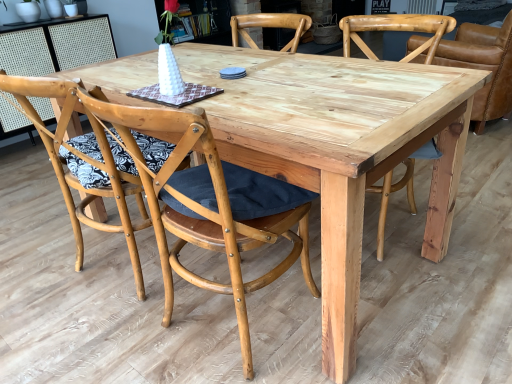
Question: Should I look upward or downward to see natural wood chair at center, which ranks as the first chair in left-to-right order?

Choices:
 (A) up
 (B) down

Answer: (A)

Question: Does natural wood chair at center, which ranks as the second chair in right-to-left order, have a lesser height compared to natural wood chair at right, which is counted as the fourth chair, starting from the left?

Choices:
 (A) yes
 (B) no

Answer: (B)

Question: Does natural wood chair at center, marked as the third chair in a left-to-right arrangement, have a greater width compared to natural wood chair at right, which is counted as the fourth chair, starting from the left?

Choices:
 (A) yes
 (B) no

Answer: (B)

Question: Is natural wood chair at center, which ranks as the second chair in right-to-left order, thinner than natural wood chair at right, the first chair viewed from the right?

Choices:
 (A) yes
 (B) no

Answer: (A)

Question: Is natural wood chair at center, which ranks as the second chair in right-to-left order, positioned beyond the bounds of natural wood chair at right, the first chair viewed from the right?

Choices:
 (A) yes
 (B) no

Answer: (A)

Question: From the image's perspective, is natural wood chair at center, marked as the third chair in a left-to-right arrangement, on natural wood chair at right, which is counted as the fourth chair, starting from the left?

Choices:
 (A) no
 (B) yes

Answer: (A)

Question: Does natural wood chair at center, which ranks as the second chair in right-to-left order, touch natural wood chair at right, the first chair viewed from the right?

Choices:
 (A) yes
 (B) no

Answer: (B)

Question: From the image's perspective, is natural wood chair at right, which is counted as the fourth chair, starting from the left, beneath natural wood chair at center, which ranks as the second chair in right-to-left order?

Choices:
 (A) no
 (B) yes

Answer: (A)

Question: Could you tell me if natural wood chair at right, which is counted as the fourth chair, starting from the left, is turned towards natural wood chair at center, which ranks as the second chair in right-to-left order?

Choices:
 (A) yes
 (B) no

Answer: (B)

Question: Is natural wood chair at right, which is counted as the fourth chair, starting from the left, oriented away from natural wood chair at center, which ranks as the second chair in right-to-left order?

Choices:
 (A) no
 (B) yes

Answer: (A)

Question: Are natural wood chair at right, the first chair viewed from the right, and natural wood chair at center, which ranks as the second chair in right-to-left order, far apart?

Choices:
 (A) no
 (B) yes

Answer: (A)

Question: From a real-world perspective, does natural wood chair at right, which is counted as the fourth chair, starting from the left, sit lower than natural wood chair at center, marked as the third chair in a left-to-right arrangement?

Choices:
 (A) no
 (B) yes

Answer: (B)

Question: Is natural wood chair at right, which is counted as the fourth chair, starting from the left, located outside natural wood chair at center, marked as the third chair in a left-to-right arrangement?

Choices:
 (A) yes
 (B) no

Answer: (A)

Question: Is natural wood chair at right, which is counted as the fourth chair, starting from the left, not within natural wood chair at center, which ranks as the first chair in left-to-right order?

Choices:
 (A) no
 (B) yes

Answer: (B)